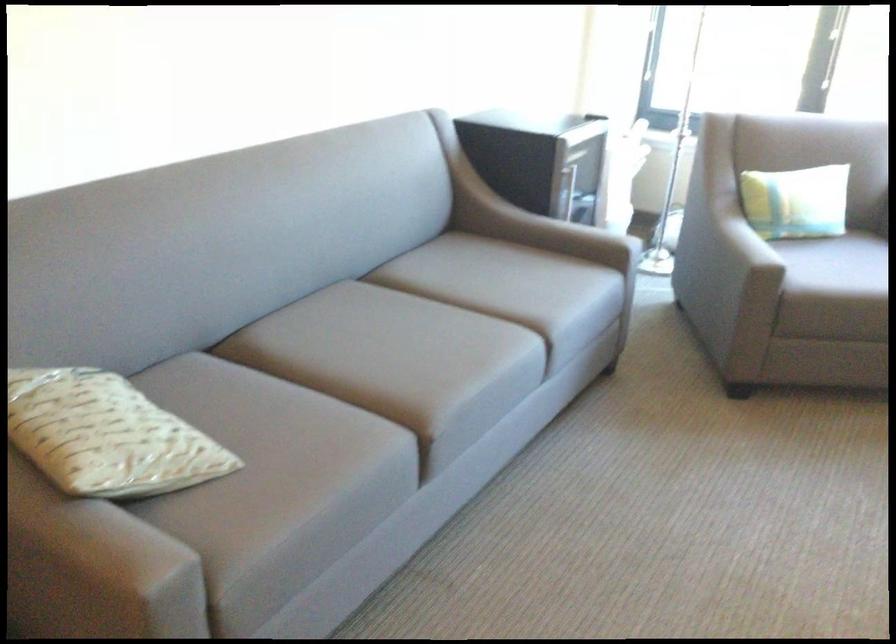
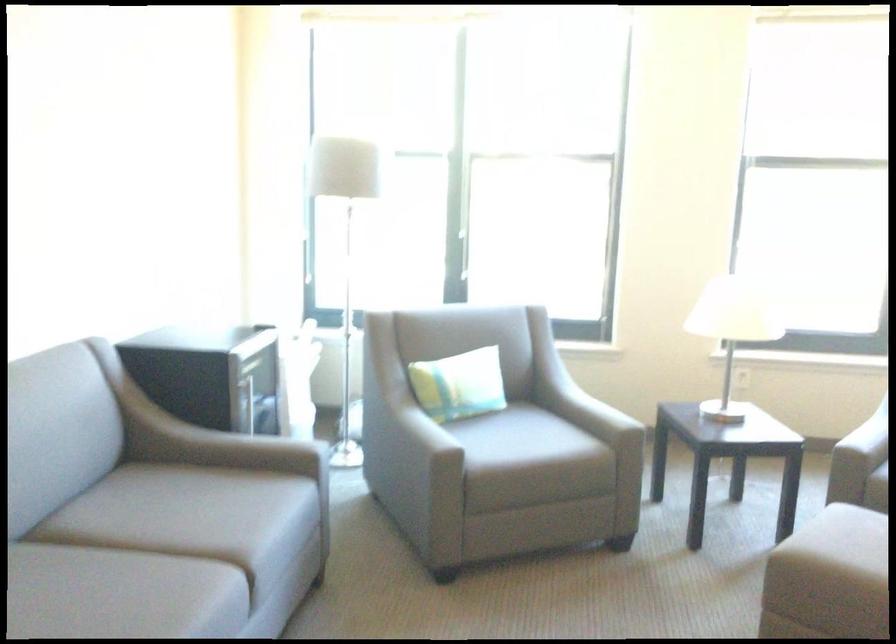
The point at (442, 328) is marked in the first image. Where is the corresponding point in the second image?

(119, 594)